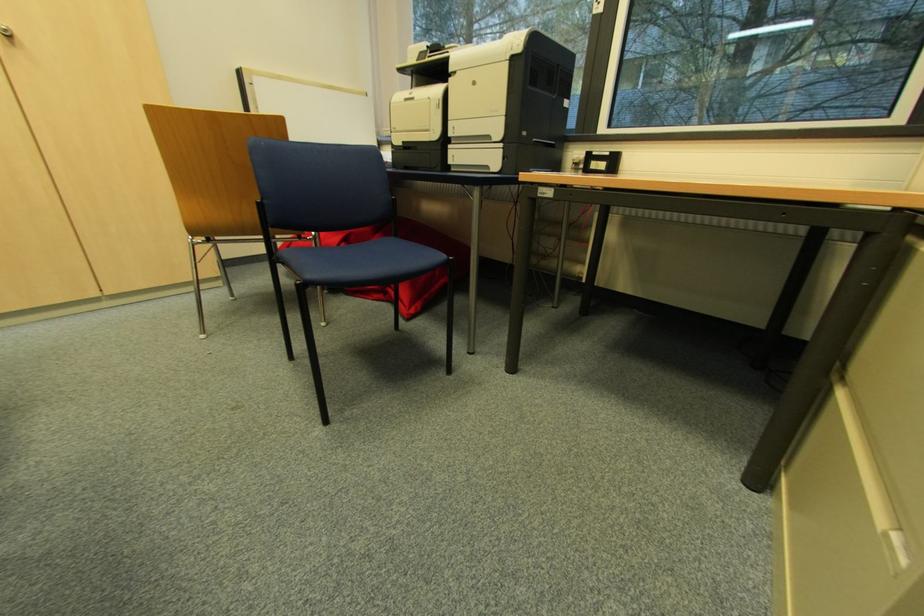
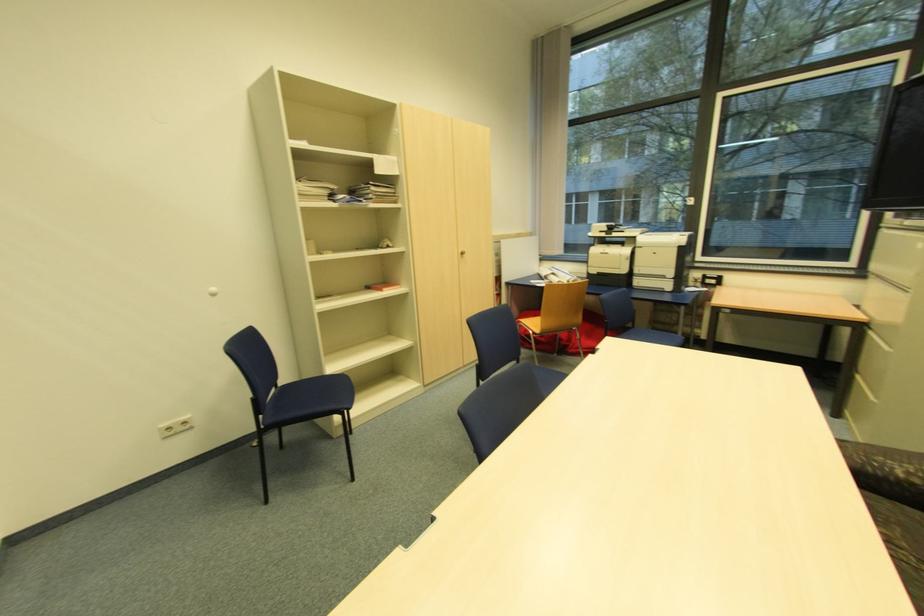
Locate, in the second image, the point that corresponds to point (843, 392) in the first image.

(860, 377)